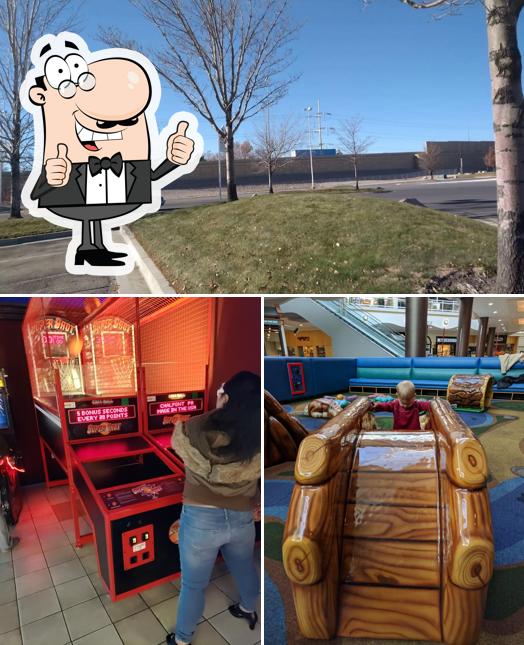
Image resolution: width=524 pixels, height=645 pixels. In order to click on arcade game in this screenshot , I will do (108, 422), (162, 411).